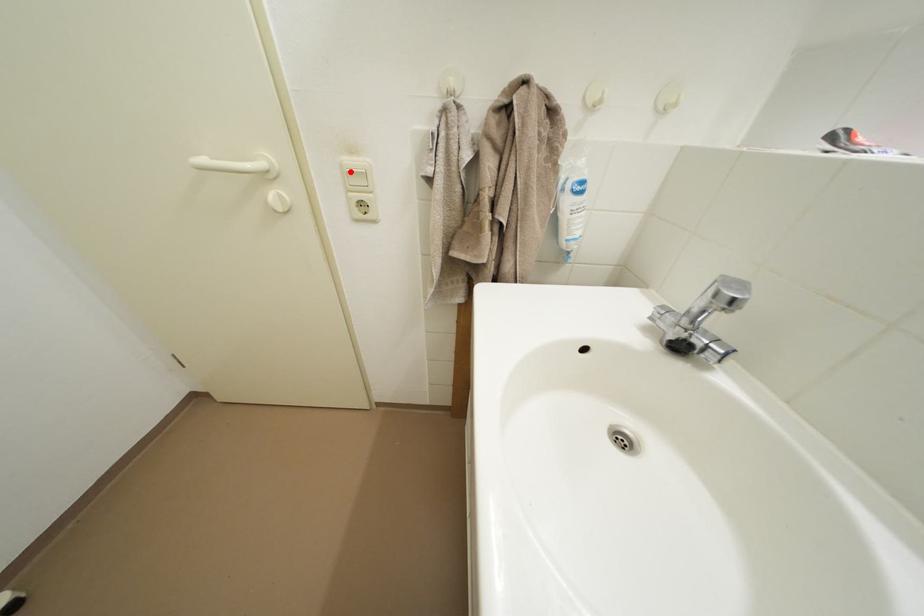
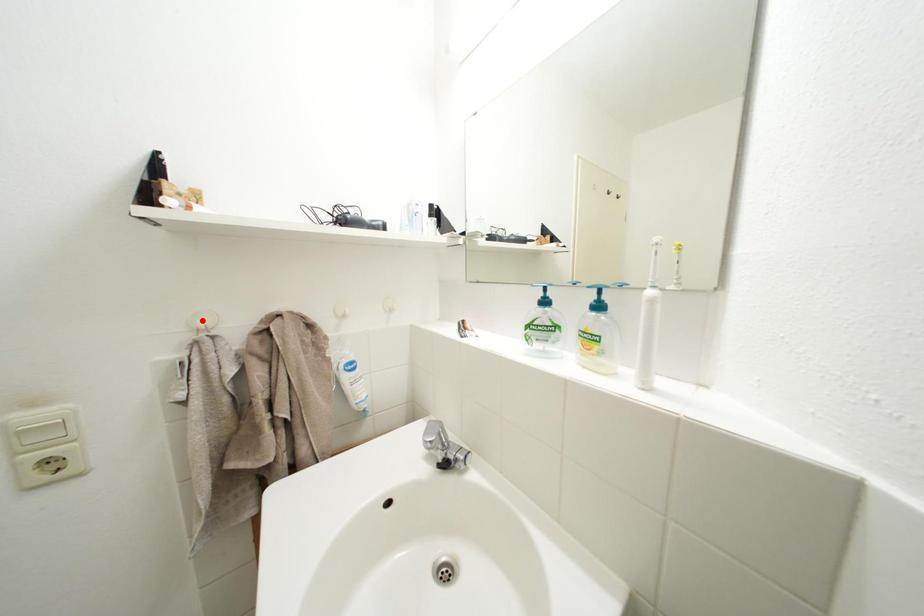
In the scene shown: I am providing you with two images of the same scene from different viewpoints. A red point is marked on the first image and another point is marked on the second image. Is the red point in image1 aligned with the point shown in image2?

No